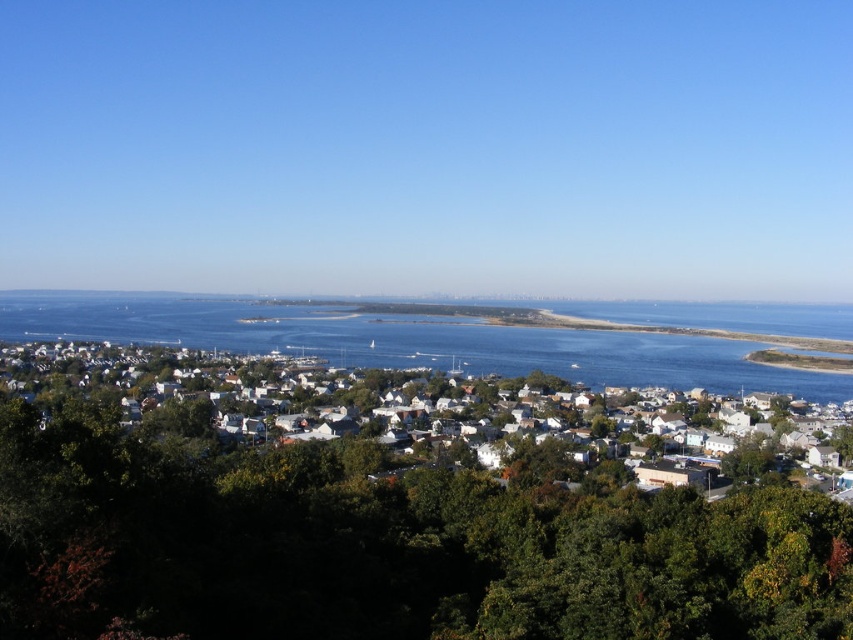
You are a drone operator tasked with capturing aerial footage of the coastal town. Your drone has a maximum flight range of 200 meters. If you are currently positioned at the green leafy tree at center, can you fly your drone to the blue water at center without exceeding its range?

The green leafy tree at center is 215.91 meters away from the blue water at center. Since the drone has a maximum range of 200 meters, it cannot reach the blue water at center from the green leafy tree at center without exceeding its range.

You are a tourist standing at the edge of the coastal town looking towards the center of the image. You see a green leafy tree at center and a blue water at center. Which object is positioned to the left when viewed from your perspective?

The green leafy tree at center is to the left of the blue water at center, so the green leafy tree at center is positioned to the left.